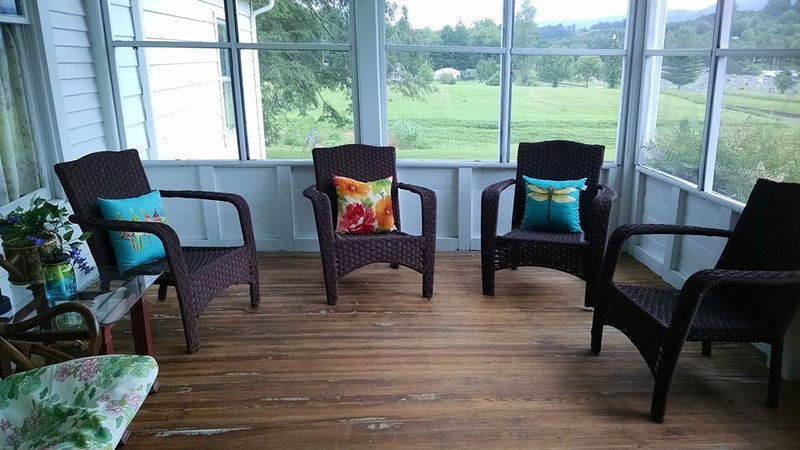
Where is `window`? The height and width of the screenshot is (450, 800). window is located at coordinates (414, 81).